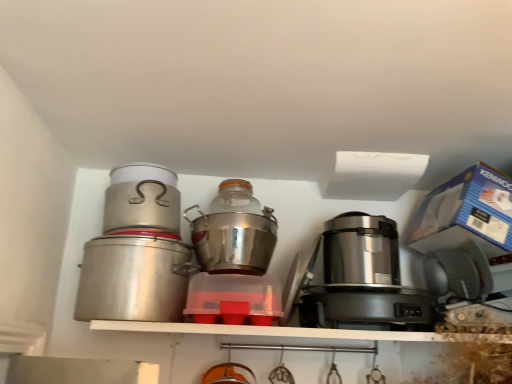
Question: From a real-world perspective, is shiny metallic pot at center, the 4th kitchen appliance from the left, located beneath brushed metal canister at left, which is the second kitchen appliance from left to right?

Choices:
 (A) no
 (B) yes

Answer: (B)

Question: Is shiny metallic pot at center, which is the 1th kitchen appliance in right-to-left order, shorter than brushed metal canister at left, which is the second kitchen appliance from left to right?

Choices:
 (A) yes
 (B) no

Answer: (B)

Question: Can you confirm if shiny metallic pot at center, the 4th kitchen appliance from the left, is smaller than brushed metal canister at left, which is the second kitchen appliance from left to right?

Choices:
 (A) no
 (B) yes

Answer: (A)

Question: Would you say shiny metallic pot at center, the 4th kitchen appliance from the left, contains brushed metal canister at left, which is the second kitchen appliance from left to right?

Choices:
 (A) no
 (B) yes

Answer: (A)

Question: From the image's perspective, is shiny metallic pot at center, the 4th kitchen appliance from the left, on brushed metal canister at left, which is the second kitchen appliance from left to right?

Choices:
 (A) no
 (B) yes

Answer: (A)

Question: From the image's perspective, is satin silver appliance at right, the first appliance positioned from the bottom, located above or below brushed metal canister at left, the 4th kitchen appliance positioned from the right?

Choices:
 (A) below
 (B) above

Answer: (A)

Question: Considering the positions of point (404, 292) and point (132, 249), is point (404, 292) closer or farther from the camera than point (132, 249)?

Choices:
 (A) farther
 (B) closer

Answer: (A)

Question: From a real-world perspective, is satin silver appliance at right, the first appliance positioned from the bottom, physically located above or below brushed metal canister at left, marked as the first kitchen appliance in a left-to-right arrangement?

Choices:
 (A) above
 (B) below

Answer: (B)

Question: Relative to brushed metal canister at left, marked as the first kitchen appliance in a left-to-right arrangement, is satin silver appliance at right, the second appliance in the top-to-bottom sequence, in front or behind?

Choices:
 (A) behind
 (B) front

Answer: (B)

Question: Relative to brushed metal canister at left, the 4th kitchen appliance positioned from the right, is shiny metallic pot at center, the 4th kitchen appliance from the left, in front or behind?

Choices:
 (A) behind
 (B) front

Answer: (A)

Question: From a real-world perspective, is shiny metallic pot at center, the 4th kitchen appliance from the left, positioned above or below brushed metal canister at left, the 4th kitchen appliance positioned from the right?

Choices:
 (A) above
 (B) below

Answer: (A)

Question: Does point (257, 248) appear closer or farther from the camera than point (166, 279)?

Choices:
 (A) farther
 (B) closer

Answer: (A)

Question: From the image's perspective, is shiny metallic pot at center, the 4th kitchen appliance from the left, located above or below brushed metal canister at left, marked as the first kitchen appliance in a left-to-right arrangement?

Choices:
 (A) above
 (B) below

Answer: (A)

Question: Considering the positions of shiny metallic pot at center, the 4th kitchen appliance from the left, and transparent plastic container at center, positioned as the second kitchen appliance in right-to-left order, in the image, is shiny metallic pot at center, the 4th kitchen appliance from the left, wider or thinner than transparent plastic container at center, positioned as the second kitchen appliance in right-to-left order,?

Choices:
 (A) wide
 (B) thin

Answer: (A)

Question: Considering their positions, is shiny metallic pot at center, the 4th kitchen appliance from the left, located in front of or behind transparent plastic container at center, positioned as the second kitchen appliance in right-to-left order?

Choices:
 (A) front
 (B) behind

Answer: (B)